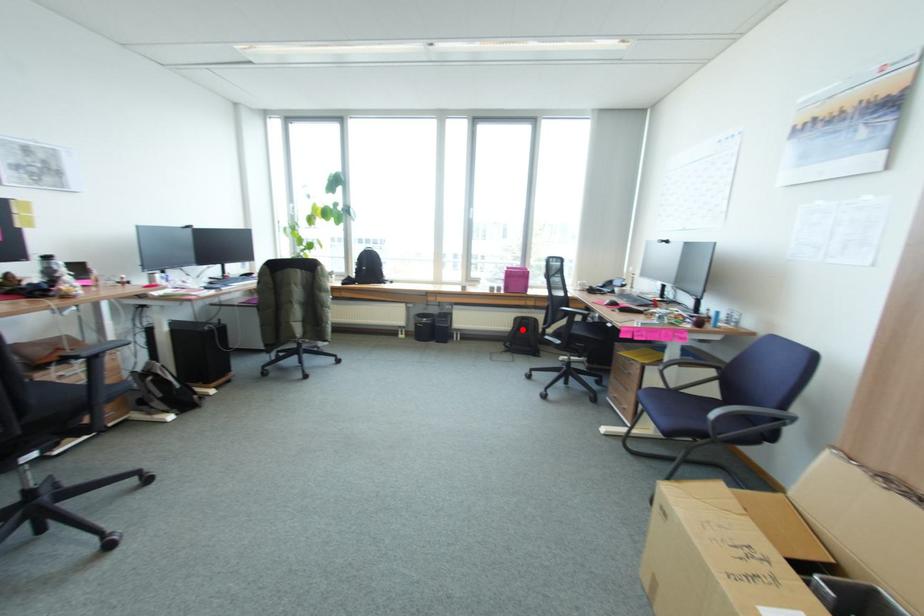
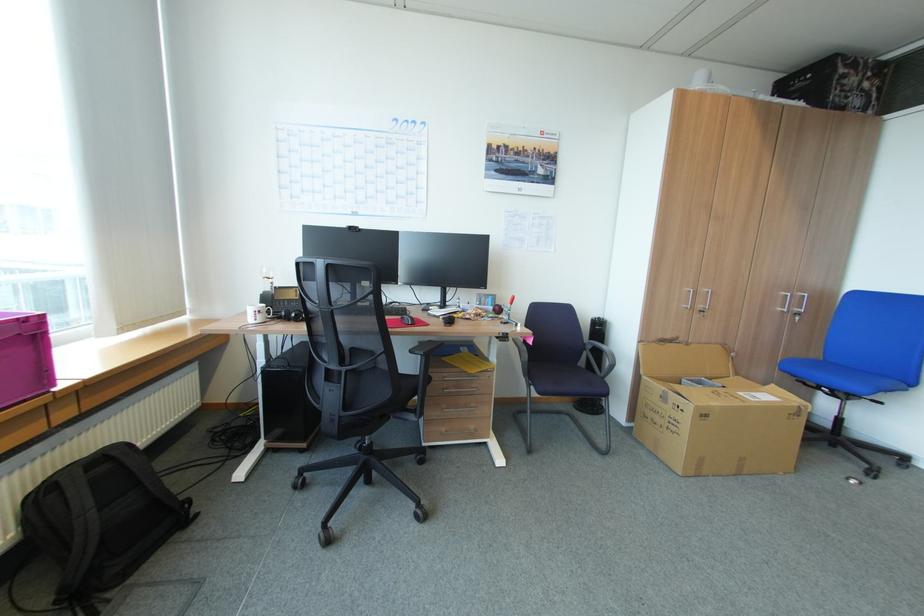
Question: I am providing you with two images of the same scene from different viewpoints. Given a red point in image1, look at the same physical point in image2. Is it:

Choices:
 (A) Closer to the viewpoint
 (B) Farther from the viewpoint

Answer: (A)